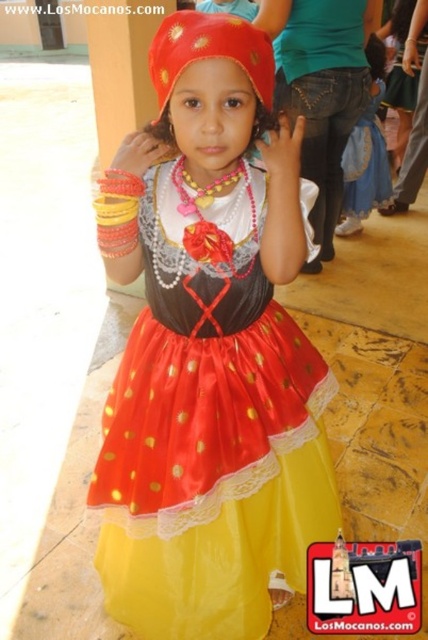
The girl is wearing a shiny satin dress at center and a matte satin headscarf at center. Which item is located to the right of the other?

The shiny satin dress at center is positioned on the right side of matte satin headscarf at center.

Based on the scene description, which object is positioned higher in the image between the shiny satin dress at center and the matte satin headscarf at center?

The shiny satin dress at center is taller than the matte satin headscarf at center, so the dress is positioned higher in the image.

Based on the coordinates provided, where is the shiny satin dress at center located in the image?

The shiny satin dress at center is located at the coordinates point [210,442].